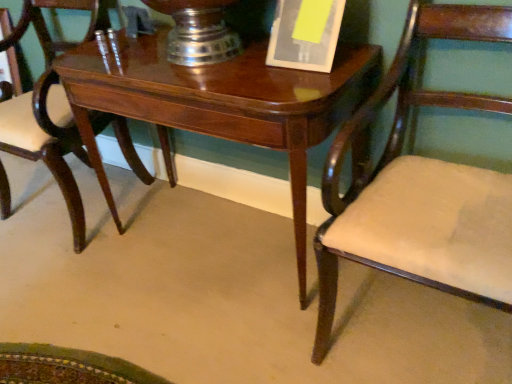
Locate an element on the screen. This screenshot has height=384, width=512. free space in front of mahogany wood chair at center, marked as the 1th chair in a left-to-right arrangement is located at coordinates (69, 281).